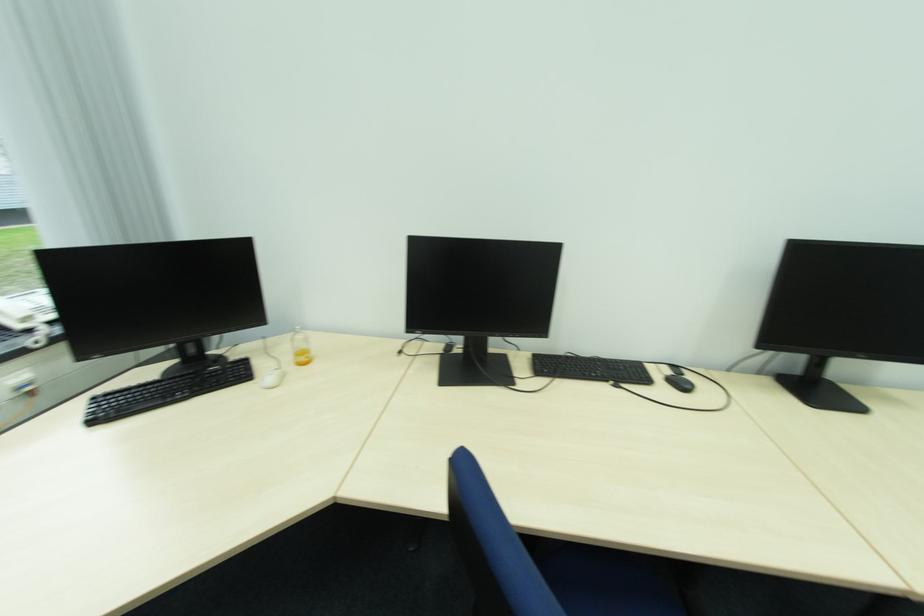
This screenshot has width=924, height=616. I want to click on blue chair sitting surface, so click(543, 562).